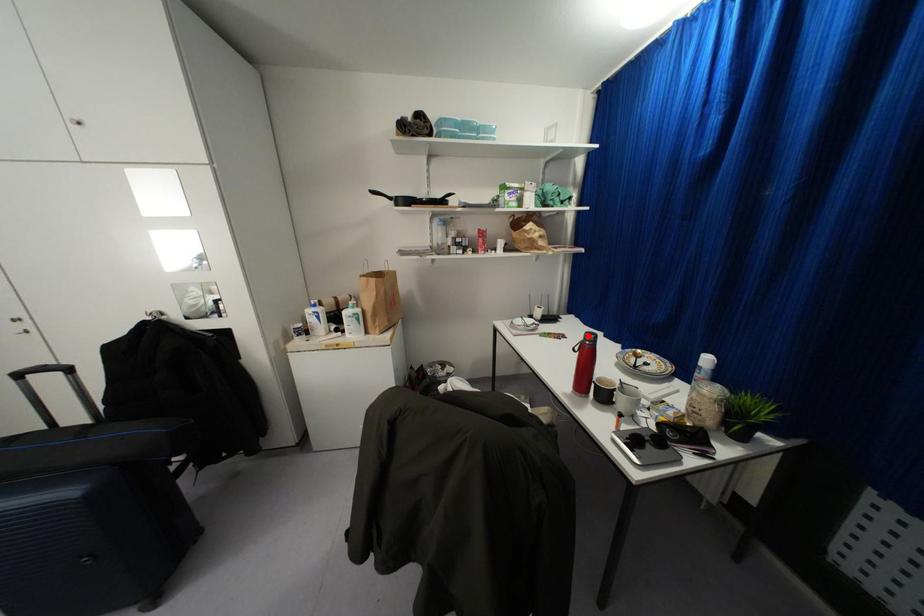
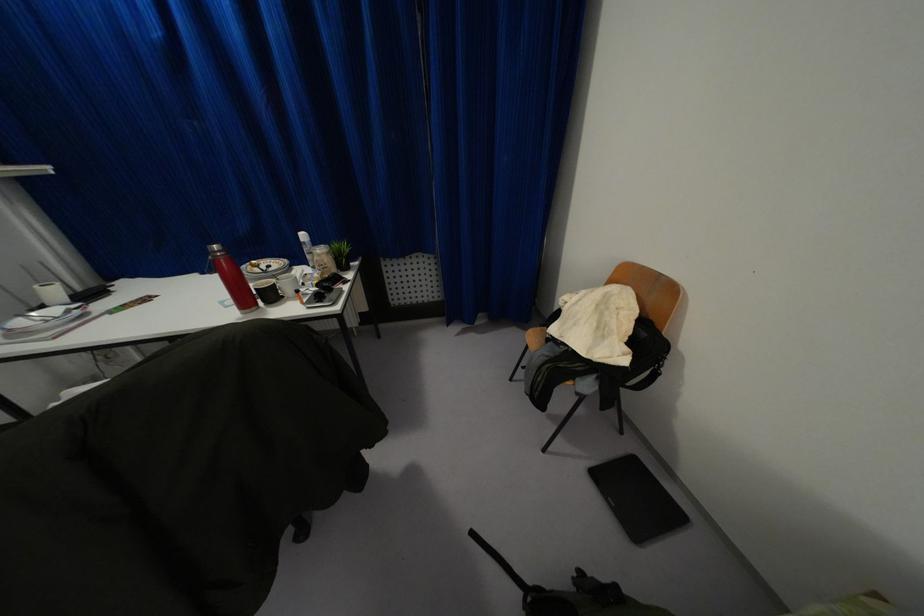
The point at the highlighted location is marked in the first image. Where is the corresponding point in the second image?

(214, 246)